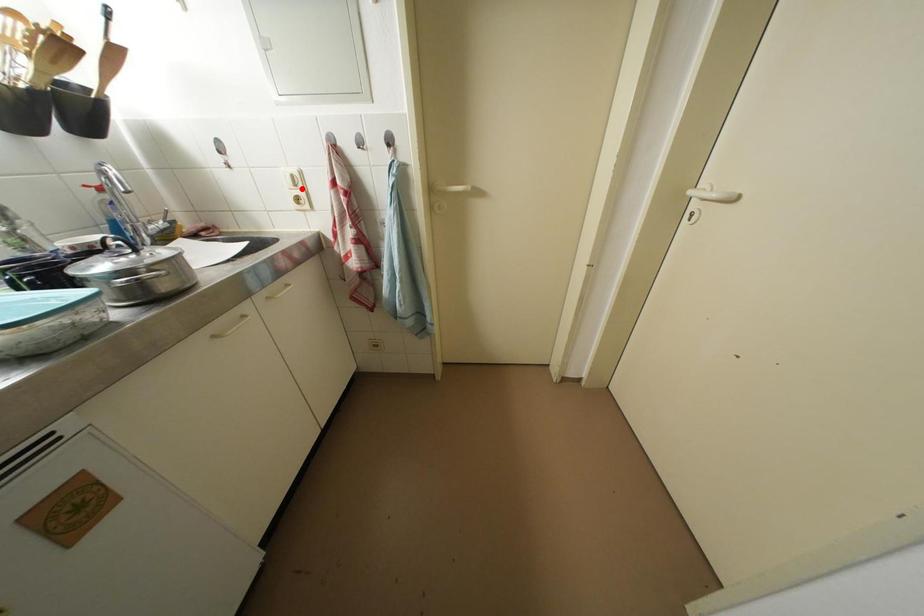
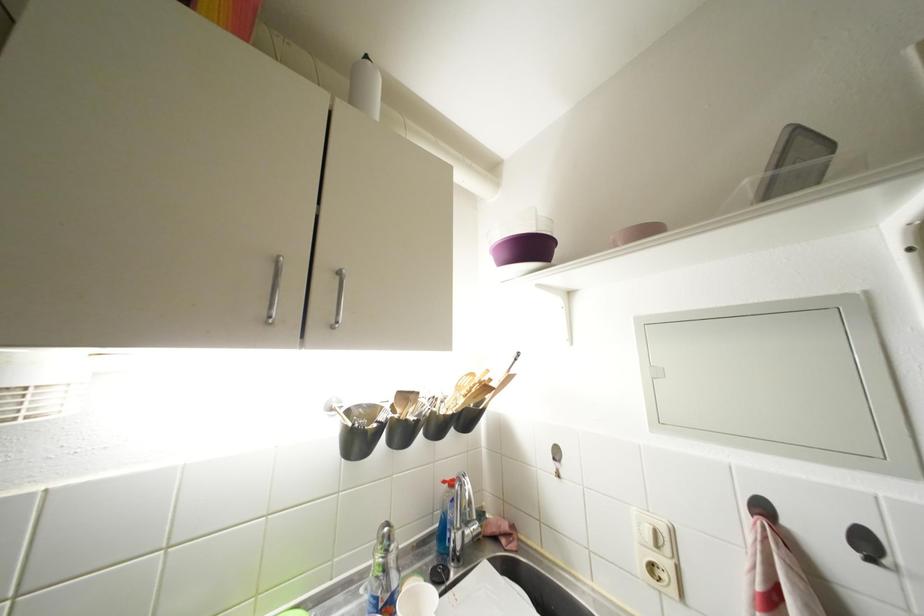
In the second image, find the point that corresponds to the highlighted location in the first image.

(663, 549)